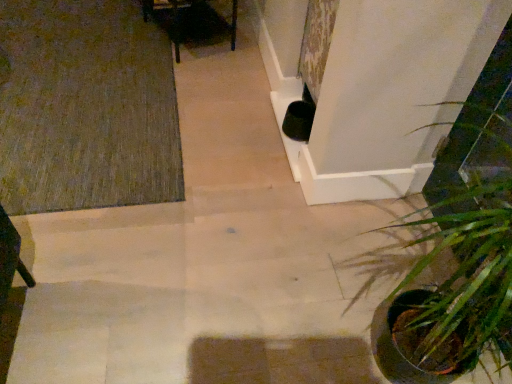
Question: Should I look upward or downward to see green leafy plant at lower right?

Choices:
 (A) up
 (B) down

Answer: (B)

Question: Can green textured rug at upper left be found inside green leafy plant at lower right?

Choices:
 (A) no
 (B) yes

Answer: (A)

Question: Can we say green leafy plant at lower right lies outside green textured rug at upper left?

Choices:
 (A) no
 (B) yes

Answer: (B)

Question: Does green leafy plant at lower right have a lesser height compared to green textured rug at upper left?

Choices:
 (A) yes
 (B) no

Answer: (B)

Question: From the image's perspective, is green leafy plant at lower right below green textured rug at upper left?

Choices:
 (A) yes
 (B) no

Answer: (A)

Question: Can you confirm if green leafy plant at lower right is wider than green textured rug at upper left?

Choices:
 (A) yes
 (B) no

Answer: (B)

Question: From the image's perspective, is green leafy plant at lower right located above green textured rug at upper left?

Choices:
 (A) no
 (B) yes

Answer: (A)

Question: Is green textured rug at upper left with green leafy plant at lower right?

Choices:
 (A) no
 (B) yes

Answer: (A)

Question: Is green textured rug at upper left closer to the viewer compared to green leafy plant at lower right?

Choices:
 (A) yes
 (B) no

Answer: (B)

Question: Considering the relative sizes of green textured rug at upper left and green leafy plant at lower right in the image provided, is green textured rug at upper left smaller than green leafy plant at lower right?

Choices:
 (A) yes
 (B) no

Answer: (A)

Question: Considering the relative sizes of green textured rug at upper left and green leafy plant at lower right in the image provided, is green textured rug at upper left taller than green leafy plant at lower right?

Choices:
 (A) yes
 (B) no

Answer: (B)

Question: From the image's perspective, does green textured rug at upper left appear lower than green leafy plant at lower right?

Choices:
 (A) no
 (B) yes

Answer: (A)

Question: Is green textured rug at upper left not near green leafy plant at lower right?

Choices:
 (A) yes
 (B) no

Answer: (A)

Question: In terms of size, does green textured rug at upper left appear bigger or smaller than green leafy plant at lower right?

Choices:
 (A) big
 (B) small

Answer: (B)